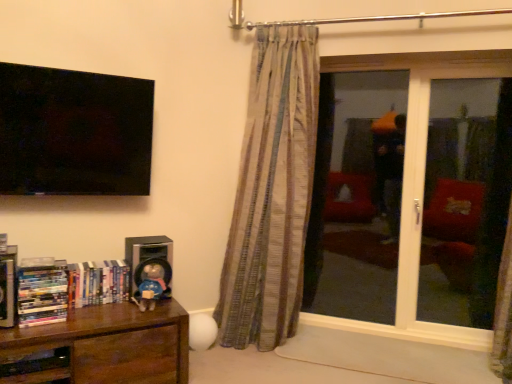
Locate an element on the screen. free space in front of matte blue plush at lower left is located at coordinates (135, 311).